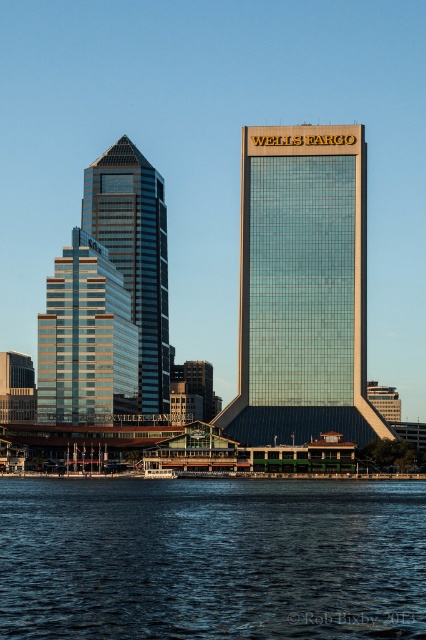
Is point (245, 188) positioned in front of point (135, 406)?

That is True.

Can you confirm if shiny glass skyscraper at center is taller than shiny glass skyscraper at left?

Indeed, shiny glass skyscraper at center has a greater height compared to shiny glass skyscraper at left.

Is point (322, 355) positioned in front of point (43, 323)?

Yes, point (322, 355) is closer to viewer.

Find the location of a particular element. shiny glass skyscraper at center is located at coordinates (302, 289).

Can you confirm if dark blue water at lower center is positioned below matte glass skyscraper at center?

Correct, dark blue water at lower center is located below matte glass skyscraper at center.

Between dark blue water at lower center and matte glass skyscraper at center, which one appears on the left side from the viewer's perspective?

From the viewer's perspective, matte glass skyscraper at center appears more on the left side.

Who is more distant from viewer, (62, 484) or (135, 243)?

Positioned behind is point (135, 243).

Identify the location of dark blue water at lower center. Image resolution: width=426 pixels, height=640 pixels. (212, 560).

Which is in front, point (89, 509) or point (339, 138)?

Point (89, 509) is in front.

Is dark blue water at lower center positioned before shiny glass skyscraper at center?

Yes, it is.

Identify the location of dark blue water at lower center. The width and height of the screenshot is (426, 640). (212, 560).